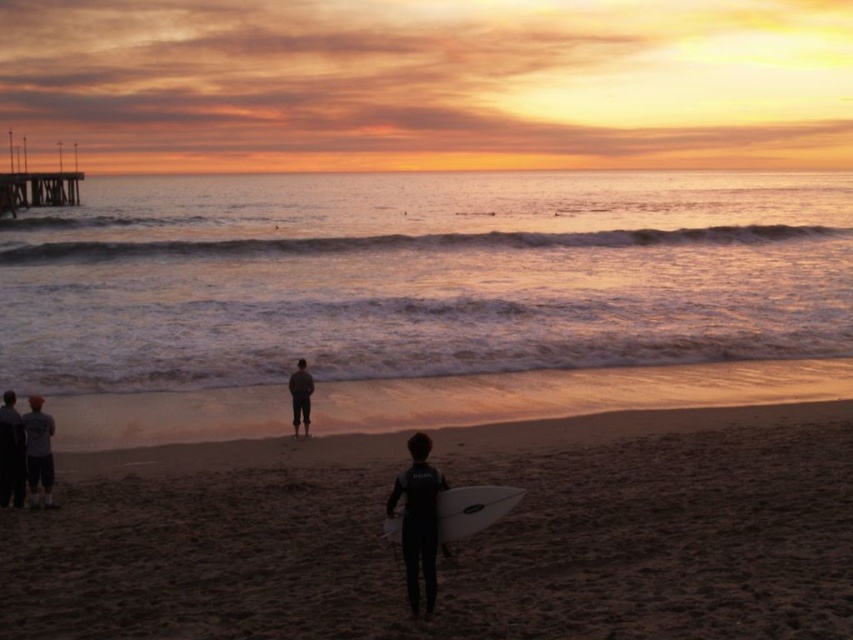
You are standing on the beach and see the golden reflective water at center and the black matte wetsuit at lower center. Which object is positioned to the right of the other?

The golden reflective water at center is to the right of the black matte wetsuit at lower center.

You are a photographer trying to capture a photo of the black matte wetsuit at lower center and the white matte surfboard at center. Since you want to ensure both are in focus, you need to know which object is bigger. Can you tell me which one is larger?

The black matte wetsuit at lower center is larger in size than the white matte surfboard at center.